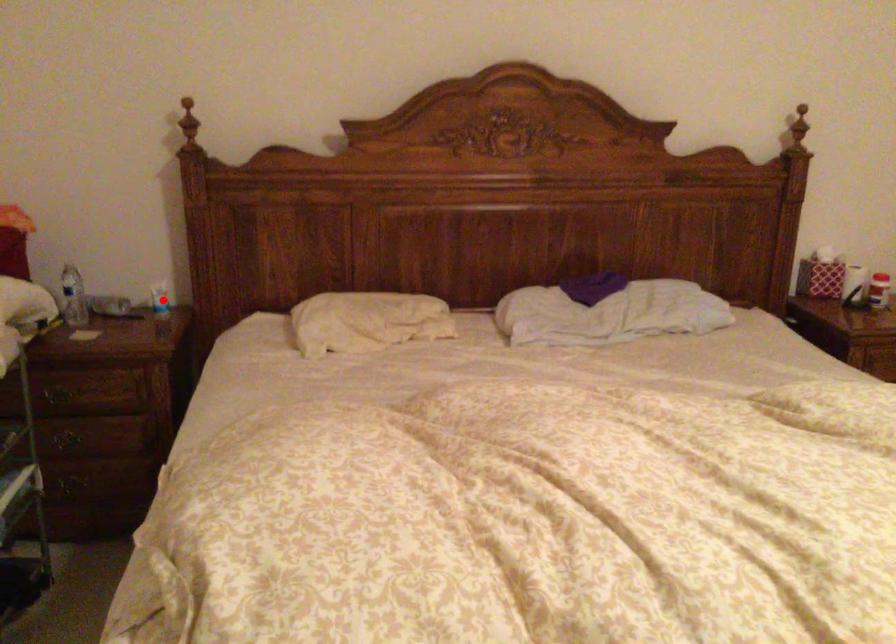
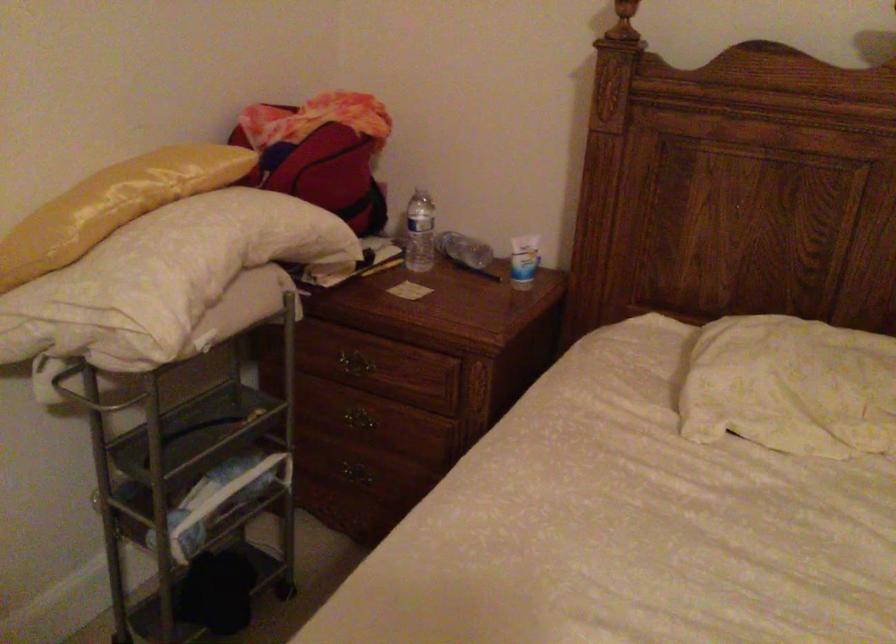
Where in the second image is the point corresponding to the highlighted location from the first image?

(523, 261)